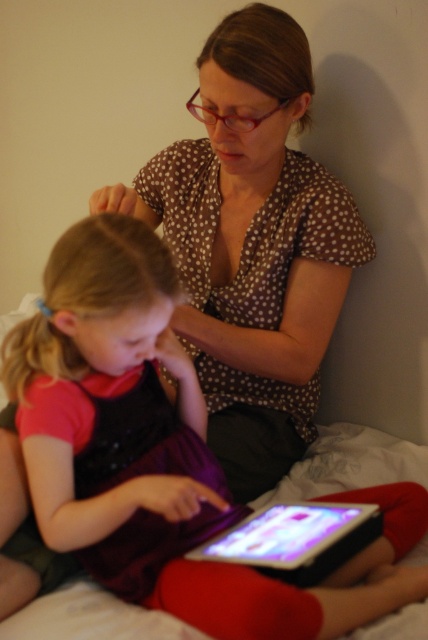
You are a photographer taking a picture of the scene. You want to ensure both the matte purple dress at center and the brown dotted blouse at upper center are clearly visible in the photo. Based on their positions, which one is closer to the bottom of the image?

The matte purple dress at center is below the brown dotted blouse at upper center, so it is closer to the bottom of the image.

You are a photographer taking a picture of the scene. To ensure both the matte purple dress at center and the black glossy tablet at lower center are clearly visible in your shot, where should you position the tablet relative to the dress?

The matte purple dress at center is positioned on the left side of the black glossy tablet at lower center, so to ensure both are clearly visible, position the tablet to the right of the dress.

You are a photographer taking a picture of the two people on the bed. You want to focus on the closer point between point [201,362] and point [276,529]. Which point should you focus on?

You should focus on point [201,362] because it is closer to the viewer than point [276,529].